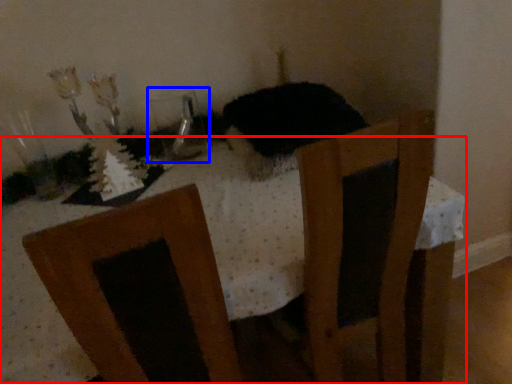
Question: Among these objects, which one is farthest to the camera, table (highlighted by a red box) or glass vase (highlighted by a blue box)?

Choices:
 (A) table
 (B) glass vase

Answer: (B)